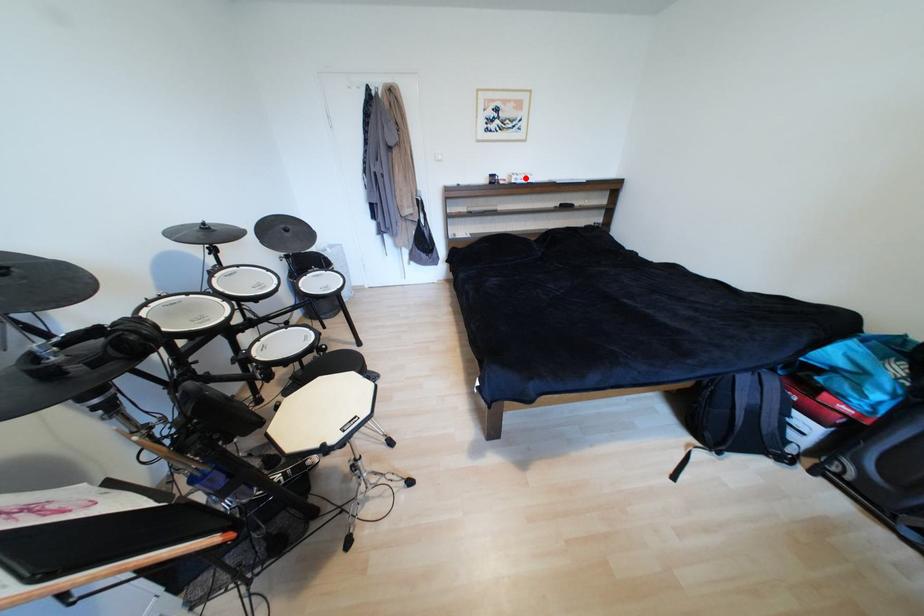
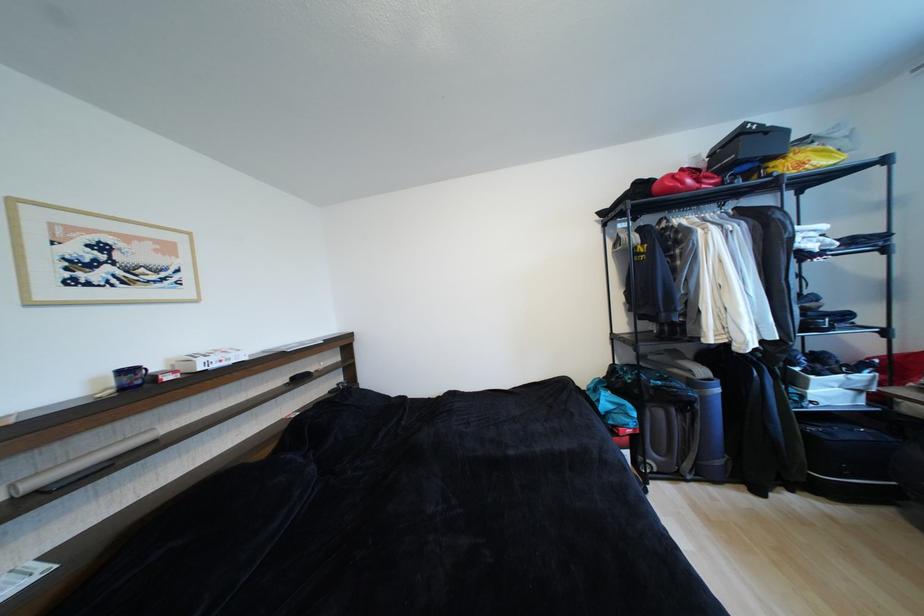
The point at the highlighted location is marked in the first image. Where is the corresponding point in the second image?

(219, 360)